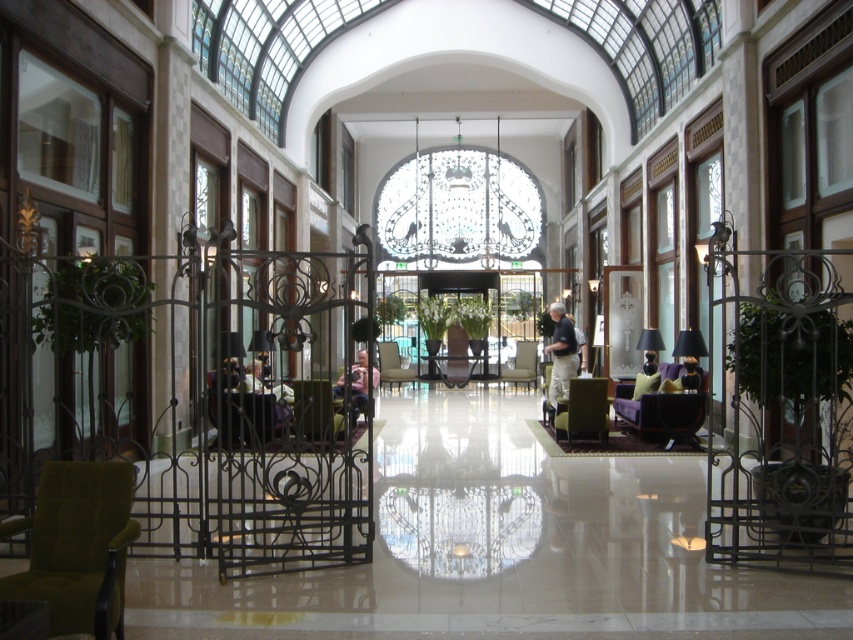
Which of these two, velvet dark brown armchair at center or velvet green armchair at center, stands shorter?

velvet dark brown armchair at center is shorter.

Consider the image. Does velvet dark brown armchair at center have a greater width compared to velvet green armchair at center?

No, velvet dark brown armchair at center is not wider than velvet green armchair at center.

Locate an element on the screen. This screenshot has height=640, width=853. velvet dark brown armchair at center is located at coordinates (674, 412).

Between velvet green armchair at lower left and matte green armchair at center, which one is positioned higher?

Positioned higher is velvet green armchair at lower left.

Does velvet green armchair at lower left have a larger size compared to matte green armchair at center?

No.

Is point (32, 538) positioned behind point (575, 380)?

No, (32, 538) is in front of (575, 380).

The image size is (853, 640). In order to click on velvet green armchair at lower left in this screenshot , I will do `click(77, 547)`.

Does velvet green armchair at lower left appear under matte gray armchair at center?

Yes.

Who is positioned more to the right, velvet green armchair at lower left or matte gray armchair at center?

matte gray armchair at center

Is point (36, 544) positioned behind point (404, 378)?

No.

Where is `velvet green armchair at lower left`? This screenshot has height=640, width=853. velvet green armchair at lower left is located at coordinates (77, 547).